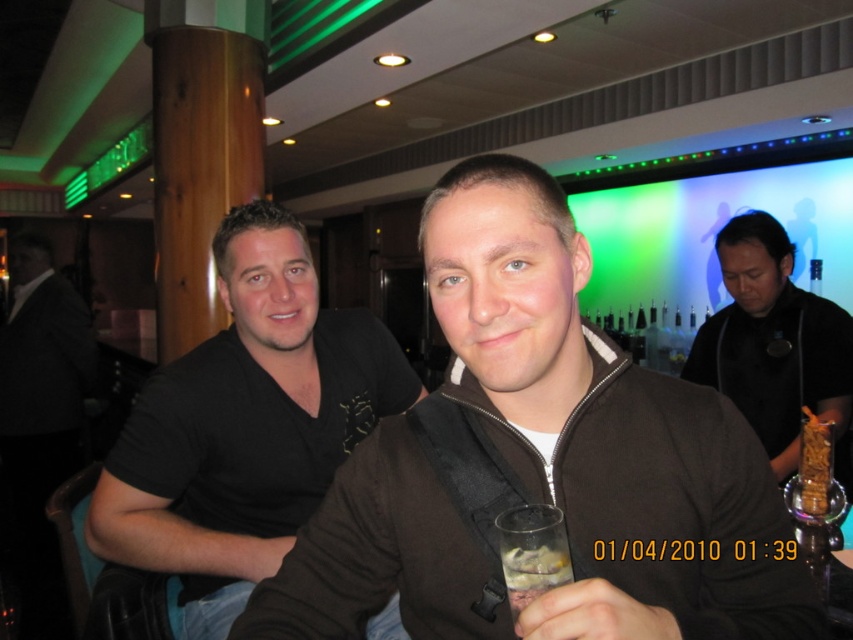
Does brown zip-up jacket at center appear over black matte shirt at right?

No.

At what (x,y) coordinates should I click in order to perform the action: click on brown zip-up jacket at center. Please return your answer as a coordinate pair (x, y). The height and width of the screenshot is (640, 853). Looking at the image, I should click on (543, 464).

I want to click on brown zip-up jacket at center, so click(x=543, y=464).

Find the location of a particular element. The image size is (853, 640). brown zip-up jacket at center is located at coordinates (543, 464).

Which is more to the left, brown zip-up jacket at center or clear glass at lower center?

brown zip-up jacket at center

Does point (544, 419) come closer to viewer compared to point (524, 602)?

No, (544, 419) is further to viewer.

Does point (465, 336) come in front of point (534, 593)?

No, it is behind (534, 593).

Find the location of a particular element. This screenshot has width=853, height=640. brown zip-up jacket at center is located at coordinates (543, 464).

Is black matte shirt at right to the left of clear glass at lower center from the viewer's perspective?

No, black matte shirt at right is not to the left of clear glass at lower center.

Based on the photo, does black matte shirt at right appear under clear glass at lower center?

No, black matte shirt at right is not below clear glass at lower center.

Consider the image. Who is more forward, (775, 396) or (512, 608)?

Point (512, 608) is more forward.

The height and width of the screenshot is (640, 853). In order to click on black matte shirt at right in this screenshot , I will do `click(773, 340)`.